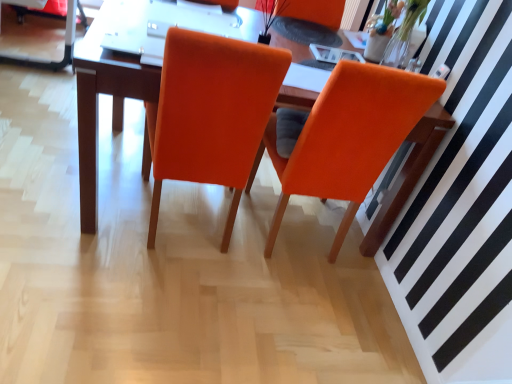
Question: Does matte wood table at center have a larger size compared to orange fabric armchair at upper center?

Choices:
 (A) no
 (B) yes

Answer: (B)

Question: Does matte wood table at center appear on the right side of orange fabric armchair at upper center?

Choices:
 (A) yes
 (B) no

Answer: (B)

Question: Is matte wood table at center wider than orange fabric armchair at upper center?

Choices:
 (A) no
 (B) yes

Answer: (B)

Question: From a real-world perspective, is matte wood table at center beneath orange fabric armchair at upper center?

Choices:
 (A) no
 (B) yes

Answer: (B)

Question: Can you confirm if matte wood table at center is smaller than orange fabric armchair at upper center?

Choices:
 (A) yes
 (B) no

Answer: (B)

Question: Considering the positions of orange fabric chair at center, the 1th chair viewed from the left, and orange fabric chair at center, which is the first chair from right to left, in the image, is orange fabric chair at center, the 1th chair viewed from the left, wider or thinner than orange fabric chair at center, which is the first chair from right to left,?

Choices:
 (A) thin
 (B) wide

Answer: (A)

Question: Does point (169, 84) appear closer or farther from the camera than point (314, 119)?

Choices:
 (A) farther
 (B) closer

Answer: (B)

Question: Considering the positions of orange fabric chair at center, the 1th chair viewed from the left, and orange fabric chair at center, which is the first chair from right to left, in the image, is orange fabric chair at center, the 1th chair viewed from the left, bigger or smaller than orange fabric chair at center, which is the first chair from right to left,?

Choices:
 (A) small
 (B) big

Answer: (B)

Question: In the image, is orange fabric chair at center, the 1th chair viewed from the left, on the left side or the right side of orange fabric chair at center, which is the first chair from right to left?

Choices:
 (A) right
 (B) left

Answer: (B)

Question: Is point (83, 215) positioned closer to the camera than point (256, 77)?

Choices:
 (A) farther
 (B) closer

Answer: (A)

Question: Considering the positions of matte wood table at center and orange fabric chair at center, which is the second chair in right-to-left order, in the image, is matte wood table at center wider or thinner than orange fabric chair at center, which is the second chair in right-to-left order,?

Choices:
 (A) thin
 (B) wide

Answer: (B)

Question: From a real-world perspective, is matte wood table at center positioned above or below orange fabric chair at center, the 1th chair viewed from the left?

Choices:
 (A) above
 (B) below

Answer: (B)

Question: Choose the correct answer: Is matte wood table at center inside orange fabric chair at center, which is the second chair in right-to-left order, or outside it?

Choices:
 (A) outside
 (B) inside

Answer: (A)

Question: Based on their positions, is orange fabric chair at center, the second chair when ordered from left to right, located to the left or right of orange fabric armchair at upper center?

Choices:
 (A) left
 (B) right

Answer: (B)

Question: Is orange fabric chair at center, the second chair when ordered from left to right, inside or outside of orange fabric armchair at upper center?

Choices:
 (A) inside
 (B) outside

Answer: (B)